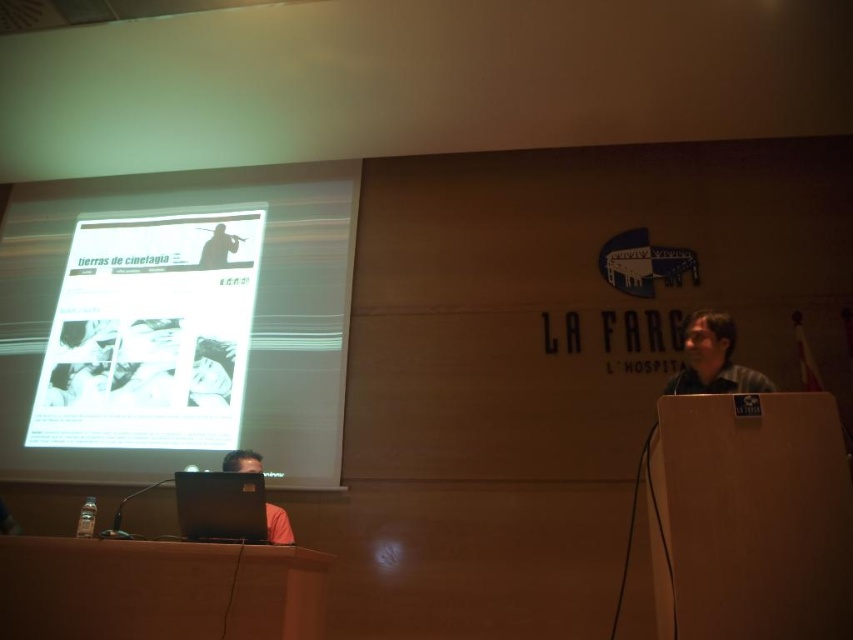
Is matte black laptop at lower left closer to the viewer compared to matte black laptop at upper left?

Yes, matte black laptop at lower left is in front of matte black laptop at upper left.

Can you confirm if matte black laptop at lower left is wider than matte black laptop at upper left?

Correct, the width of matte black laptop at lower left exceeds that of matte black laptop at upper left.

Which is in front, point (222, 468) or point (206, 246)?

Point (222, 468)

Locate an element on the screen. matte black laptop at lower left is located at coordinates (277, 525).

Is point (721, 344) positioned after point (212, 234)?

No, it is not.

Locate an element on the screen. The width and height of the screenshot is (853, 640). matte gray shirt at right is located at coordinates (712, 358).

Is point (718, 368) closer to viewer compared to point (283, 525)?

Yes, it is.

Find the location of a particular element. matte gray shirt at right is located at coordinates (712, 358).